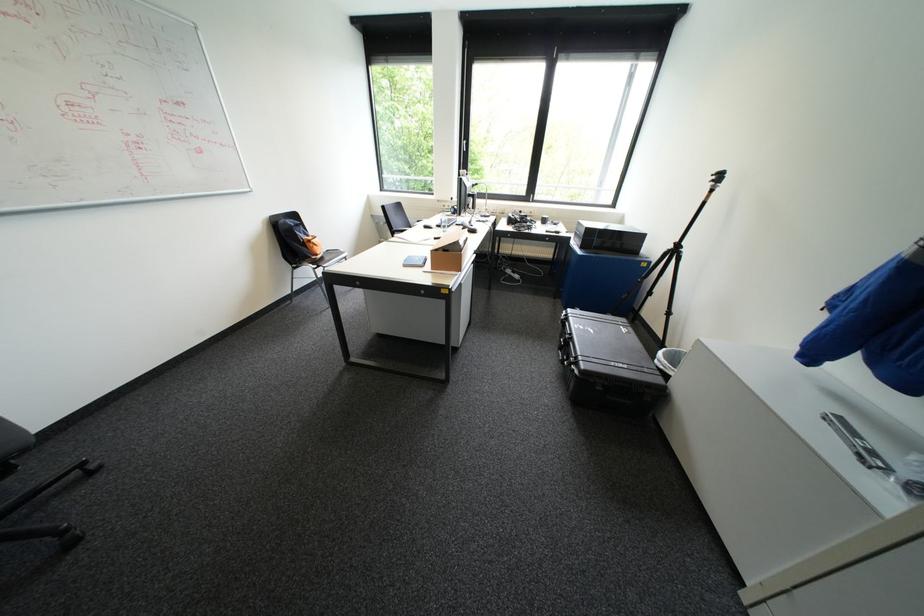
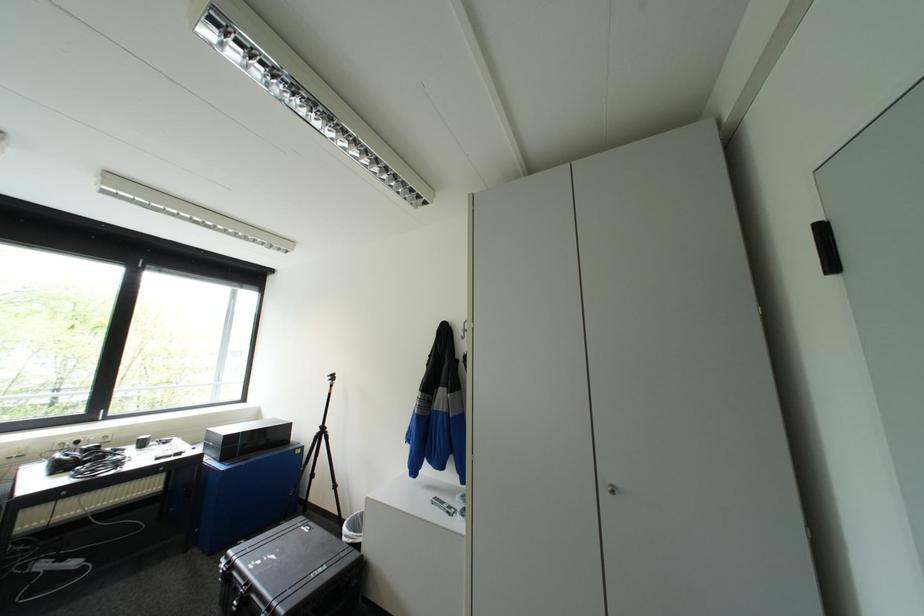
The images are taken continuously from a first-person perspective. In which direction is your viewpoint rotating?

The camera's rotation is toward right-up.